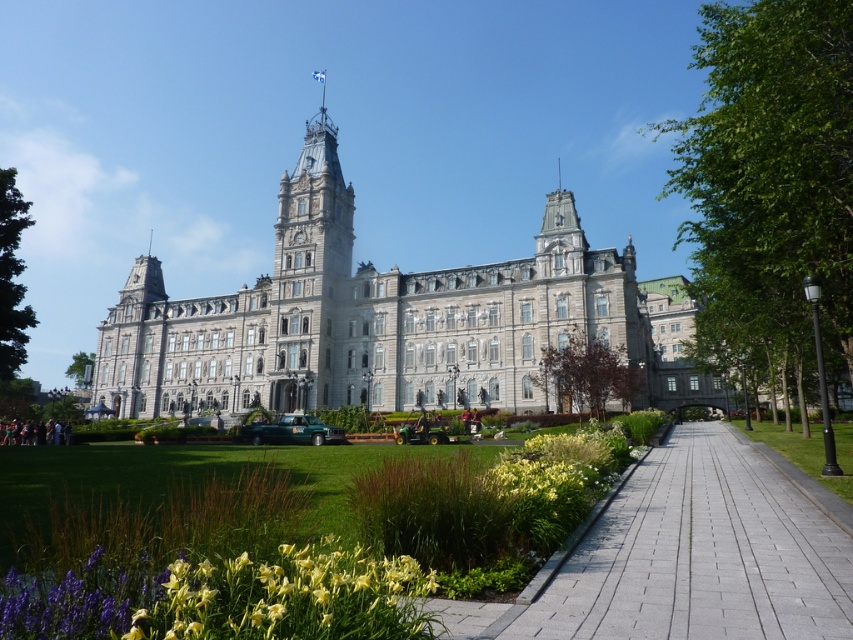
Who is more distant from viewer, (x=223, y=342) or (x=22, y=620)?

Point (x=223, y=342)

The width and height of the screenshot is (853, 640). I want to click on gray stone building at center, so click(376, 321).

Between gray stone building at center and gray stone tower at center, which one appears on the left side from the viewer's perspective?

Positioned to the left is gray stone tower at center.

Looking at this image, does gray stone building at center have a smaller size compared to gray stone tower at center?

No, gray stone building at center is not smaller than gray stone tower at center.

This screenshot has height=640, width=853. I want to click on gray stone building at center, so click(x=376, y=321).

At what (x,y) coordinates should I click in order to perform the action: click on gray stone building at center. Please return your answer as a coordinate pair (x, y). Looking at the image, I should click on pyautogui.click(x=376, y=321).

Is point (497, 566) more distant than point (271, 384)?

No, it is not.

The image size is (853, 640). In order to click on yellow-green foliage at lower center in this screenshot , I will do `click(318, 556)`.

Is point (399, 593) less distant than point (300, 166)?

Yes, it is.

This screenshot has width=853, height=640. I want to click on yellow-green foliage at lower center, so click(318, 556).